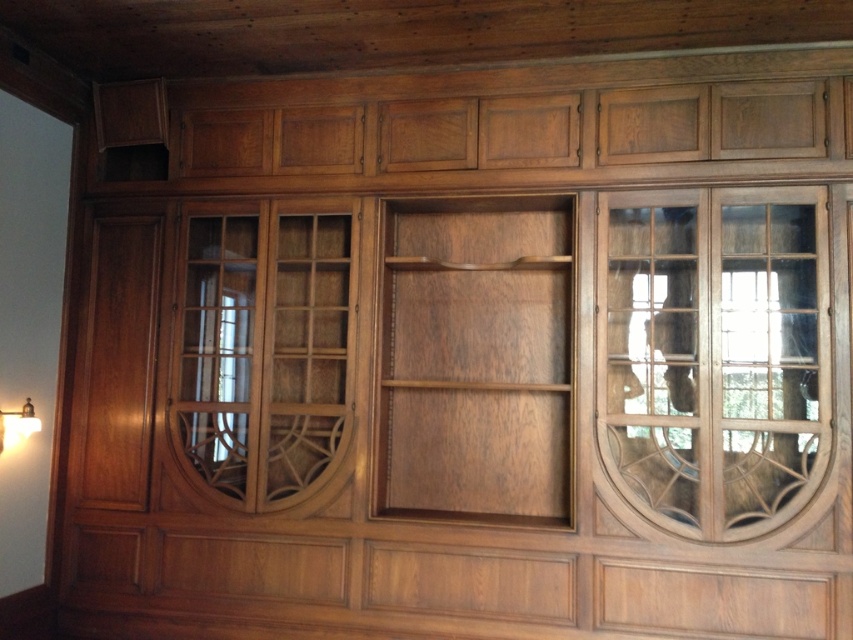
You are organizing a shelf and need to place the matte gold lampshade at lower left. The transparent wood glass door at center right is in the way. Can you move the lampshade to the right side of the glass door without moving the door?

The transparent wood glass door at center right is located above the matte gold lampshade at lower left, so moving the lampshade to the right side of the glass door would require moving it horizontally to the right while keeping it below the door. This should be possible as long as there is enough space on the shelf to the right of the lampshade.

You are trying to decide whether to place a rectangular decorative item on the clear glass door at center or the matte gold lampshade at lower left. Which surface can accommodate a wider object?

The clear glass door at center might be wider than matte gold lampshade at lower left, so it can accommodate a wider object.